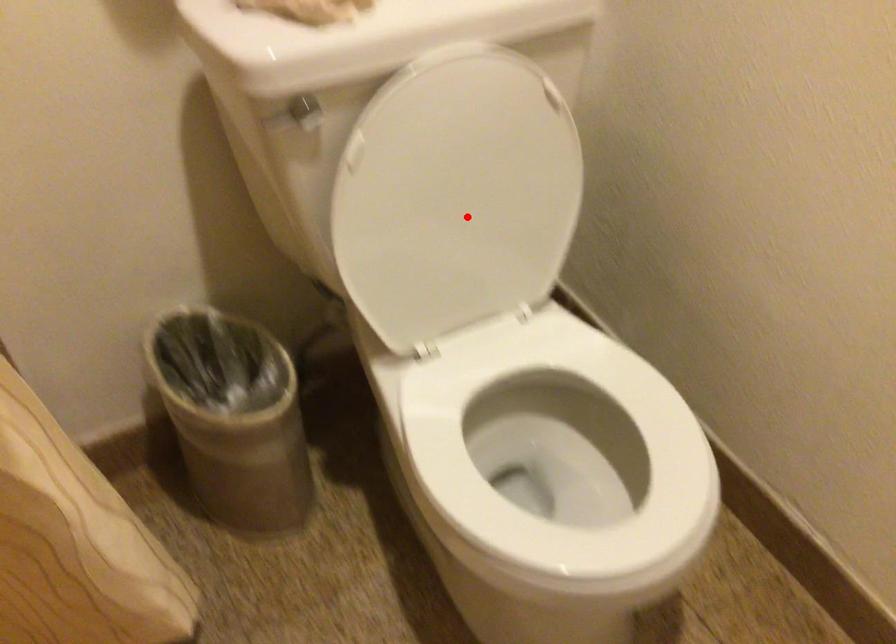
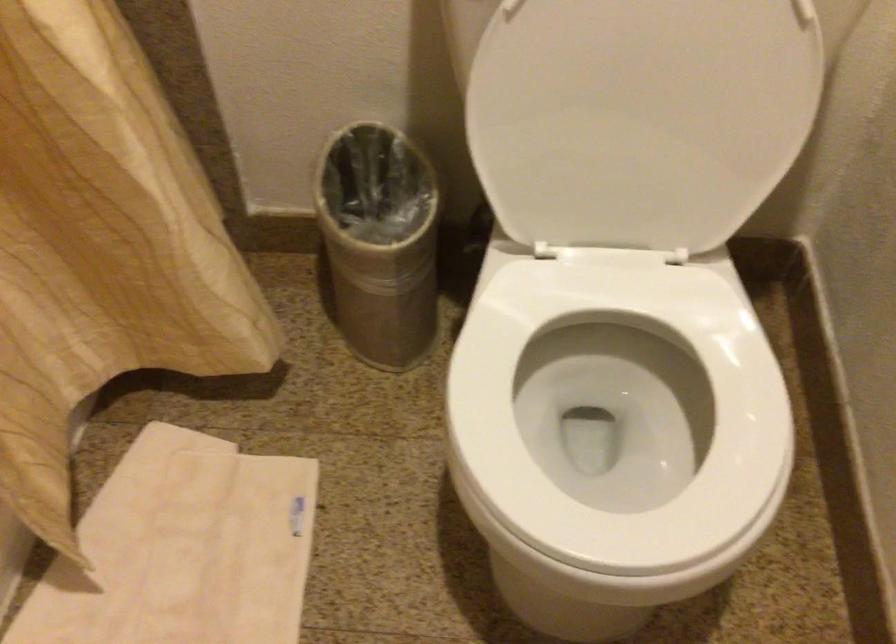
Question: I am providing you with two images of the same scene from different viewpoints. Image1 has a red point marked. In image2, the corresponding 3D location appears at what relative position? Reply with the corresponding letter.

Choices:
 (A) Closer
 (B) Farther

Answer: (A)